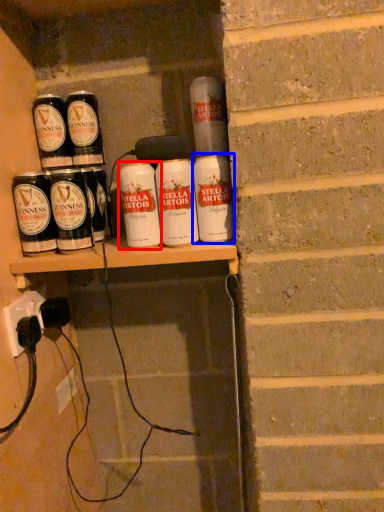
Question: Which point is further to the camera, tin can (highlighted by a red box) or tin can (highlighted by a blue box)?

Choices:
 (A) tin can
 (B) tin can

Answer: (A)